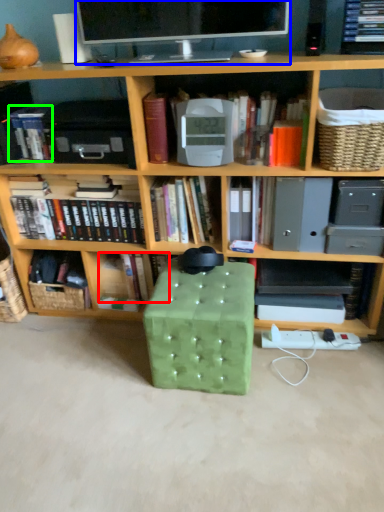
Question: Which object is the closest to the book (highlighted by a red box)? Choose among these: television (highlighted by a blue box) or book (highlighted by a green box).

Choices:
 (A) television
 (B) book

Answer: (B)